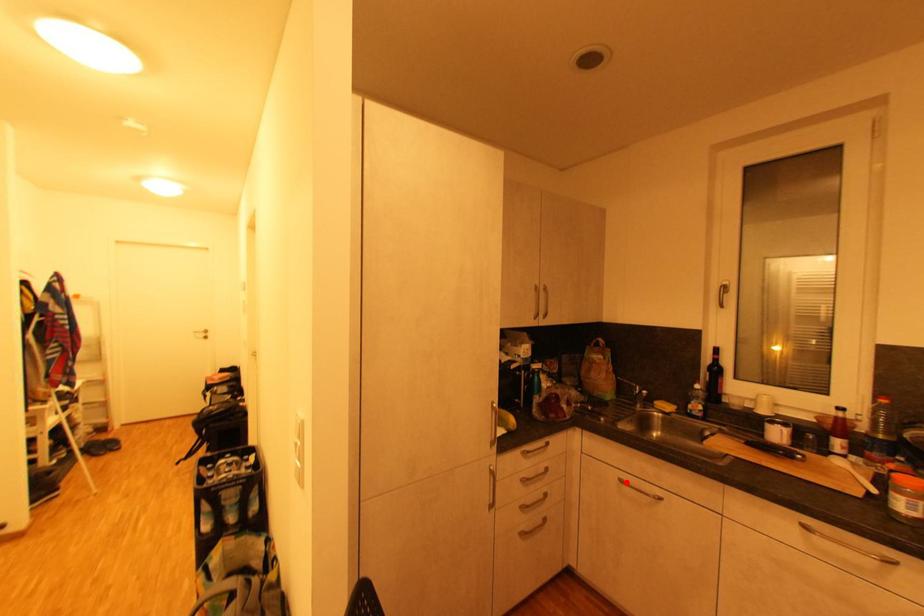
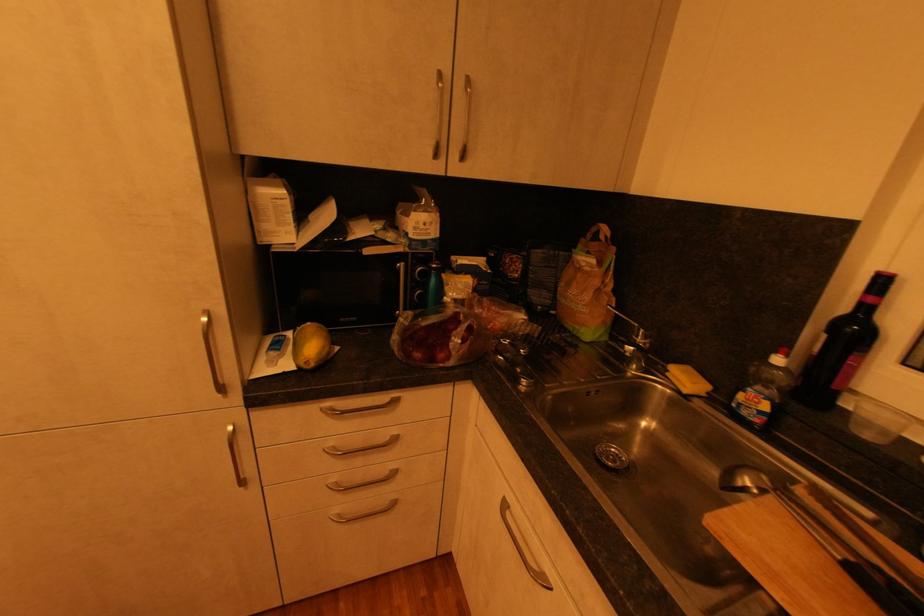
The point at the highlighted location is marked in the first image. Where is the corresponding point in the second image?

(508, 507)